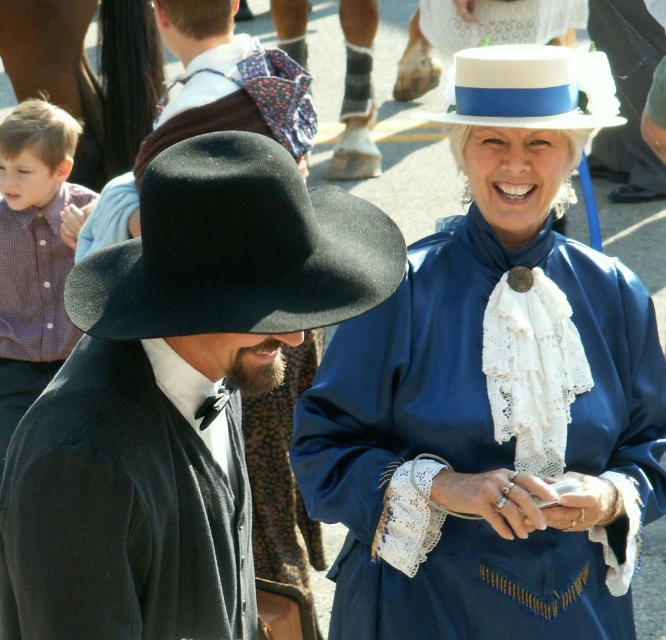
Can you confirm if plaid shirt at left is bigger than white felt dress hat at upper center?

Indeed, plaid shirt at left has a larger size compared to white felt dress hat at upper center.

Does plaid shirt at left have a greater height compared to white felt dress hat at upper center?

Indeed, plaid shirt at left has a greater height compared to white felt dress hat at upper center.

At what (x,y) coordinates should I click in order to perform the action: click on plaid shirt at left. Please return your answer as a coordinate pair (x, y). Image resolution: width=666 pixels, height=640 pixels. Looking at the image, I should click on (33, 253).

Does point (252, 282) come closer to viewer compared to point (260, 184)?

No, (252, 282) is behind (260, 184).

Who is more forward, (83, 397) or (115, 289)?

Point (83, 397)

The width and height of the screenshot is (666, 640). In order to click on matte black hat at left in this screenshot , I will do `click(174, 396)`.

This screenshot has height=640, width=666. Find the location of `matte black hat at left`. matte black hat at left is located at coordinates (174, 396).

In the scene shown: Is the position of matte black hat at left less distant than that of white felt dress hat at upper center?

That is True.

Can you confirm if matte black hat at left is positioned to the left of white felt dress hat at upper center?

Correct, you'll find matte black hat at left to the left of white felt dress hat at upper center.

Describe the element at coordinates (174, 396) in the screenshot. I see `matte black hat at left` at that location.

In order to click on matte black hat at left in this screenshot , I will do `click(174, 396)`.